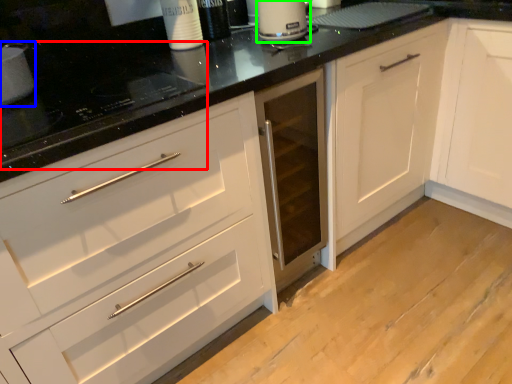
Question: Which object is the farthest from appliance (highlighted by a red box)? Choose among these: appliance (highlighted by a blue box) or kitchen appliance (highlighted by a green box).

Choices:
 (A) appliance
 (B) kitchen appliance

Answer: (B)